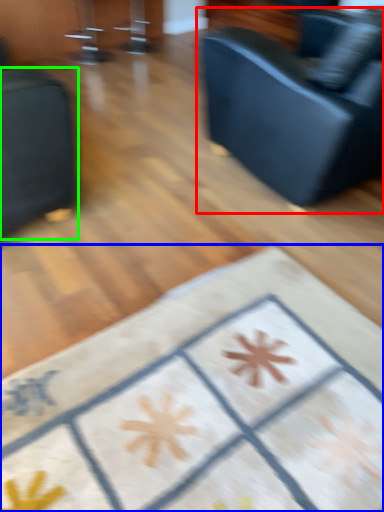
Question: Based on their relative distances, which object is farther from studio couch (highlighted by a red box)? Choose from furniture (highlighted by a blue box) and furniture (highlighted by a green box).

Choices:
 (A) furniture
 (B) furniture

Answer: (A)